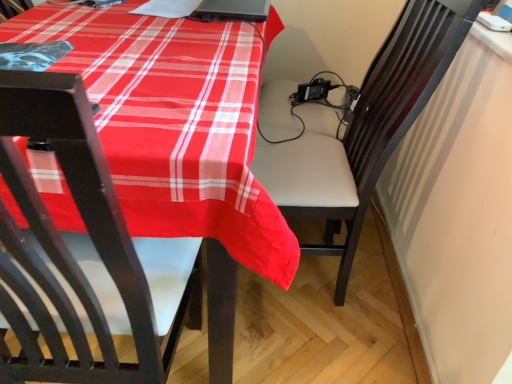
Locate an element on the screen. The width and height of the screenshot is (512, 384). vacant space underneath white leather chair at center (from a real-world perspective) is located at coordinates (306, 286).